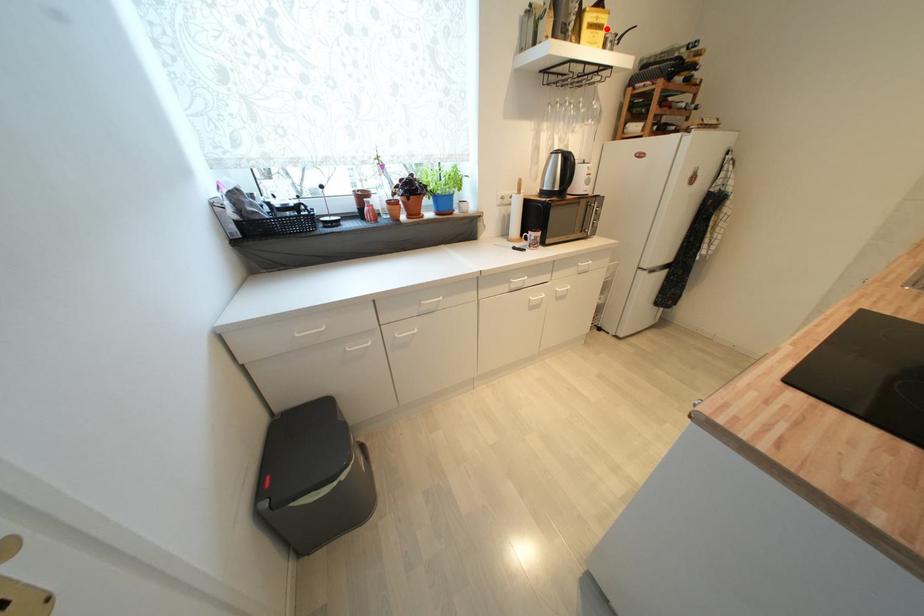
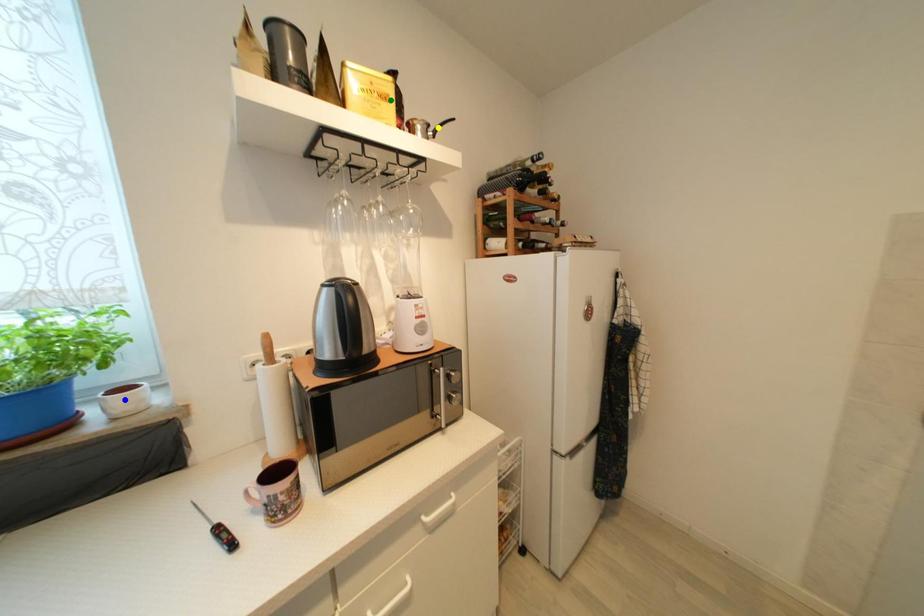
Question: I am providing you with two images of the same scene from different viewpoints. A red point is marked on the first image. You are given multiple points on the second image. Can you choose the point in image 2 that corresponds to the point in image 1?

Choices:
 (A) yellow point
 (B) blue point
 (C) green point

Answer: (C)